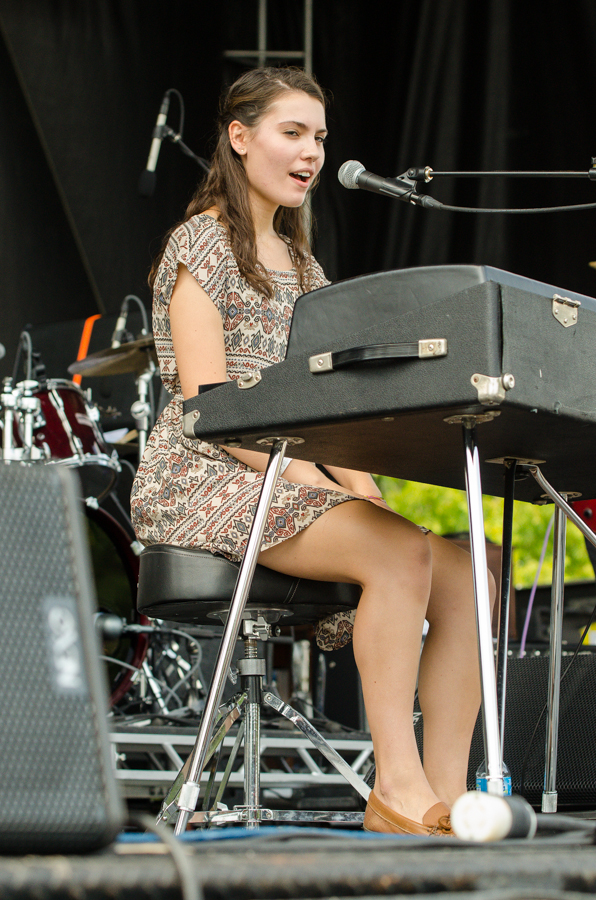
Identify the location of piano. This screenshot has height=900, width=596. (356, 417).